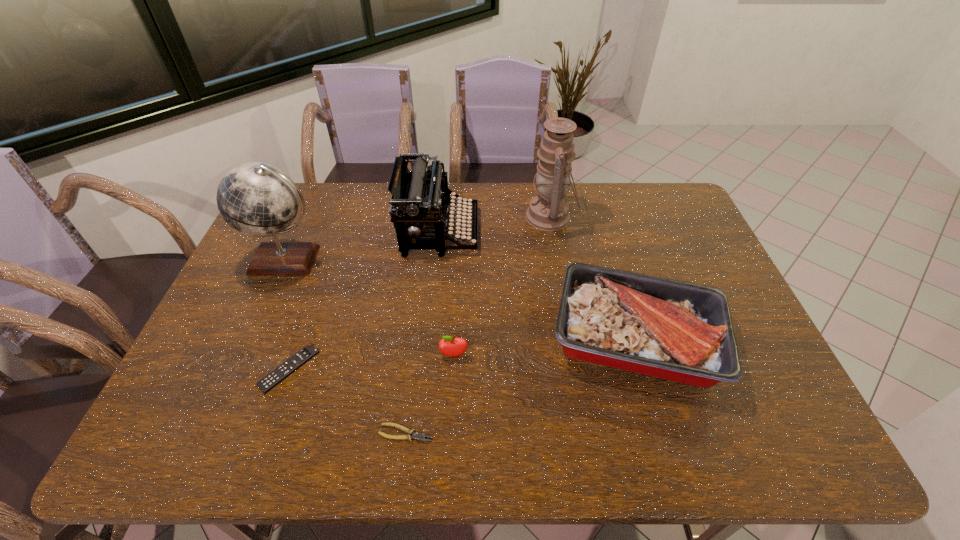
Image resolution: width=960 pixels, height=540 pixels. In the image, there is a desktop. In order to click on free space at the near edge in this screenshot , I will do `click(488, 428)`.

Locate an element on the screen. vacant space at the left edge of the desktop is located at coordinates (217, 316).

The height and width of the screenshot is (540, 960). In the image, there is a desktop. Find the location of `free space at the right edge`. free space at the right edge is located at coordinates (692, 269).

The width and height of the screenshot is (960, 540). In order to click on vacant region at the far right corner in this screenshot , I will do `click(666, 214)`.

Where is `free space between the nearest object and the globe`? free space between the nearest object and the globe is located at coordinates (347, 346).

What are the coordinates of `free space that is in between the pliers and the oil lamp` in the screenshot? It's located at (478, 325).

I want to click on vacant point located between the nearest object and the remote control, so click(348, 401).

Find the location of a particular element. Image resolution: width=960 pixels, height=540 pixels. unoccupied area between the apple and the tray is located at coordinates (544, 347).

You are a GUI agent. You are given a task and a screenshot of the screen. Output one action in this format:
    pyautogui.click(x=<x>, y=<y>)
    Task: Click on the empty space between the tray and the third tallest object
    This screenshot has width=960, height=540.
    Given the screenshot: What is the action you would take?
    pyautogui.click(x=538, y=285)

You are a GUI agent. You are given a task and a screenshot of the screen. Output one action in this format:
    pyautogui.click(x=<x>, y=<y>)
    Task: Click on the free point between the pliers and the globe
    This screenshot has width=960, height=540.
    Given the screenshot: What is the action you would take?
    pyautogui.click(x=347, y=346)